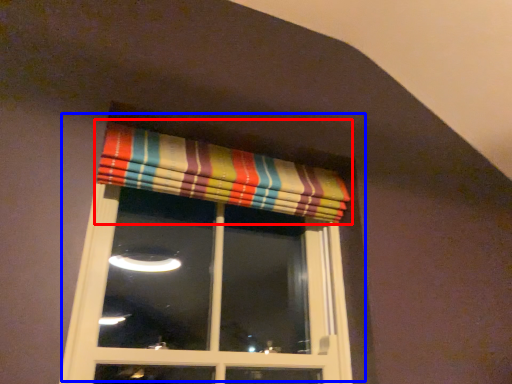
Question: Which object appears farthest to the camera in this image, curtain (highlighted by a red box) or window (highlighted by a blue box)?

Choices:
 (A) curtain
 (B) window

Answer: (A)